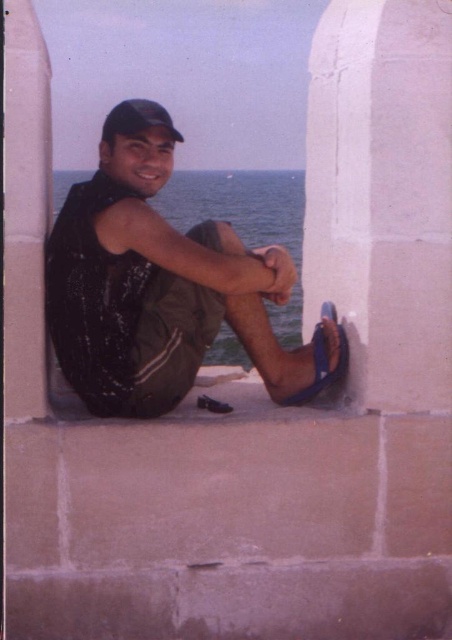
Does white stone pillar at right have a greater height compared to blue rubber sandal at lower center?

Indeed, white stone pillar at right has a greater height compared to blue rubber sandal at lower center.

Who is more distant from viewer, [353,76] or [325,314]?

Point [325,314]

Does point (329, 33) come behind point (339, 371)?

Yes, point (329, 33) is behind point (339, 371).

Identify the location of white stone pillar at right. (382, 195).

Can you confirm if white stone pillar at right is smaller than black matte baseball cap at upper center?

Indeed, white stone pillar at right has a smaller size compared to black matte baseball cap at upper center.

Who is more forward, (429, 13) or (111, 122)?

Point (429, 13)

The height and width of the screenshot is (640, 452). Find the location of `white stone pillar at right`. white stone pillar at right is located at coordinates (382, 195).

Is shiny black vest at center smaller than blue rubber sandal at lower center?

No, shiny black vest at center is not smaller than blue rubber sandal at lower center.

Consider the image. Is shiny black vest at center shorter than blue rubber sandal at lower center?

In fact, shiny black vest at center may be taller than blue rubber sandal at lower center.

Which is in front, point (75, 220) or point (320, 364)?

Point (75, 220) is more forward.

Find the location of a particular element. The width and height of the screenshot is (452, 640). shiny black vest at center is located at coordinates (164, 292).